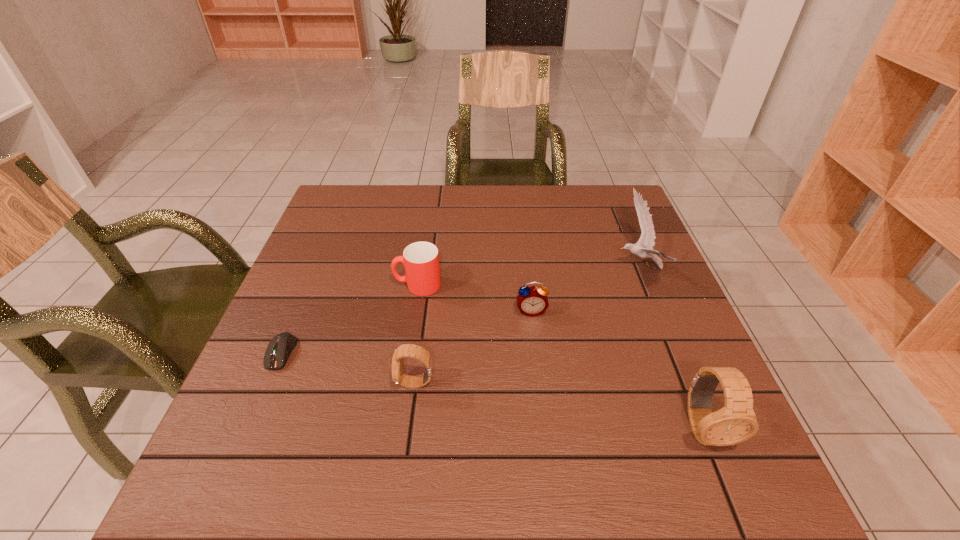
Where is `the shorter watch`? the shorter watch is located at coordinates (406, 350).

At what (x,y) coordinates should I click in order to perform the action: click on the farther watch. Please return your answer as a coordinate pair (x, y). The height and width of the screenshot is (540, 960). Looking at the image, I should click on (406, 350).

Identify the location of the taller watch. (736, 422).

The width and height of the screenshot is (960, 540). What are the coordinates of `the nearest object` in the screenshot? It's located at (736, 422).

The height and width of the screenshot is (540, 960). I want to click on cup, so click(x=421, y=259).

You are a GUI agent. You are given a task and a screenshot of the screen. Output one action in this format:
    pyautogui.click(x=<x>, y=<y>)
    Task: Click on the third object from right to left
    The height and width of the screenshot is (540, 960).
    Given the screenshot: What is the action you would take?
    pyautogui.click(x=532, y=301)

Where is `gull`? This screenshot has height=540, width=960. gull is located at coordinates (643, 248).

Where is `the shortest object`? the shortest object is located at coordinates (278, 350).

Locate an element on the screen. This screenshot has height=540, width=960. the leftmost object is located at coordinates (278, 350).

The width and height of the screenshot is (960, 540). Find the location of `vacant space positioned on the face of the left watch`. vacant space positioned on the face of the left watch is located at coordinates (295, 383).